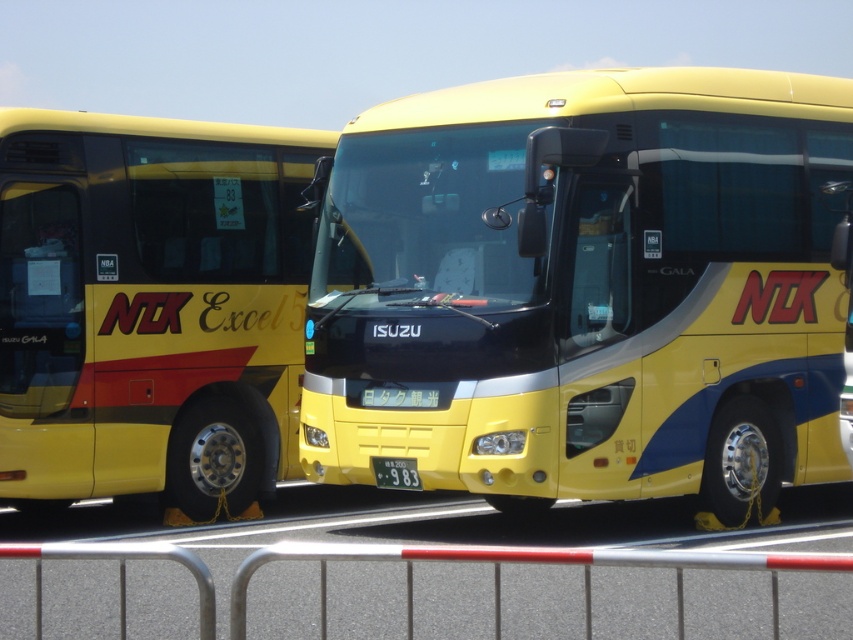
Question: Which object is farther from the camera taking this photo?

Choices:
 (A) yellow matte bus at center
 (B) yellow matte bus at left

Answer: (B)

Question: Can you confirm if yellow matte bus at center is positioned above green matte license plate at center?

Choices:
 (A) no
 (B) yes

Answer: (B)

Question: In this image, where is yellow matte bus at center located relative to silver metallic rail at lower center?

Choices:
 (A) below
 (B) above

Answer: (B)

Question: Which of the following is the farthest from the observer?

Choices:
 (A) silver metallic rail at lower center
 (B) yellow matte bus at center
 (C) green matte license plate at center

Answer: (C)

Question: Estimate the real-world distances between objects in this image. Which object is farther from the yellow matte bus at left?

Choices:
 (A) green matte license plate at center
 (B) yellow matte bus at center

Answer: (A)

Question: Is yellow matte bus at center bigger than green matte license plate at center?

Choices:
 (A) yes
 (B) no

Answer: (A)